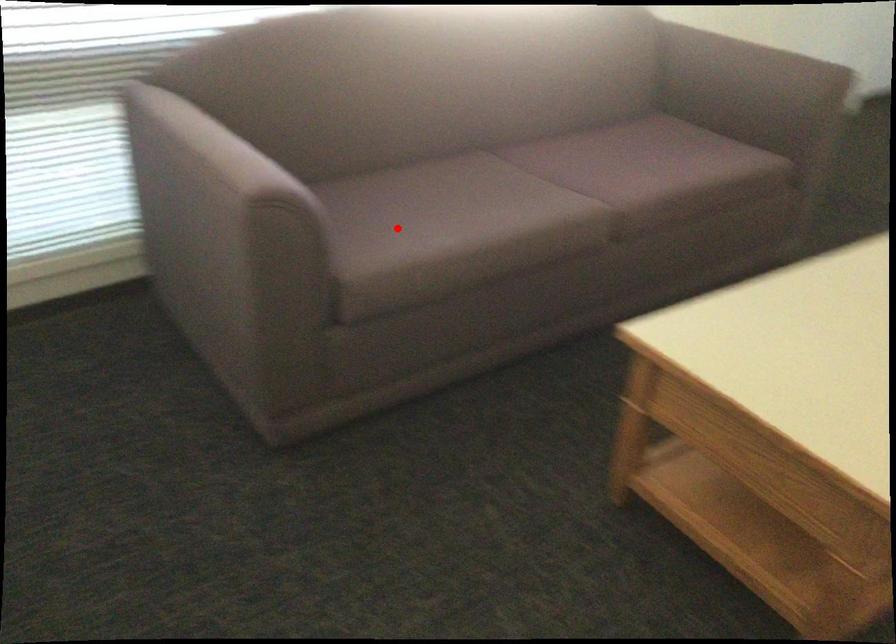
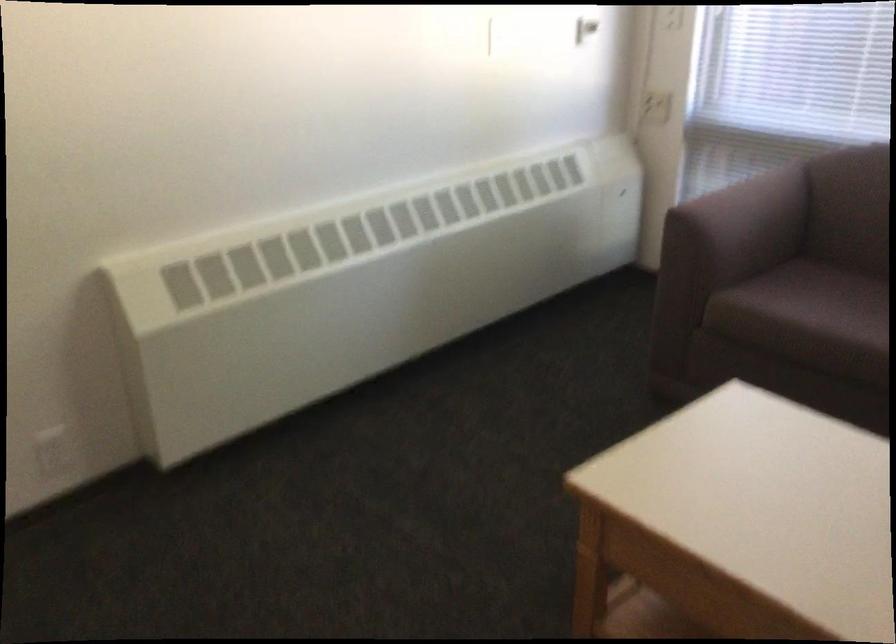
Where in the second image is the point corresponding to the highlighted location from the first image?

(807, 303)